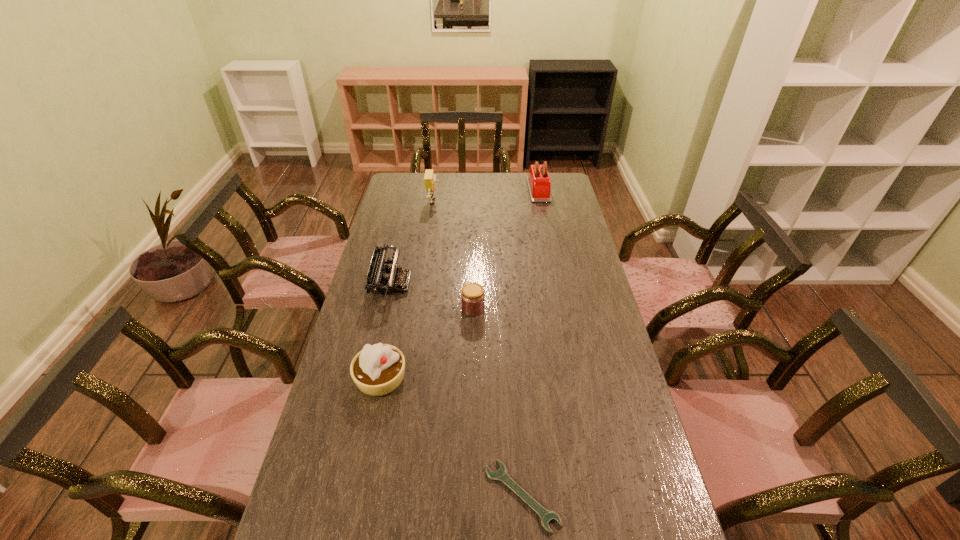
Where is `vacant area at the right edge of the desktop`? vacant area at the right edge of the desktop is located at coordinates (568, 228).

The height and width of the screenshot is (540, 960). I want to click on vacant area that lies between the second shortest object and the typewriter, so pos(432,296).

Identify the location of free space between the typewriter and the sponge. Image resolution: width=960 pixels, height=540 pixels. (413, 242).

Locate an element on the screen. The height and width of the screenshot is (540, 960). free point between the jam and the toaster is located at coordinates (506, 249).

Identify the location of empty location between the typewriter and the rightmost object. This screenshot has width=960, height=540. (465, 237).

Find the location of a particular element. Image resolution: width=960 pixels, height=540 pixels. free spot between the rightmost object and the typewriter is located at coordinates (465, 237).

You are a GUI agent. You are given a task and a screenshot of the screen. Output one action in this format:
    pyautogui.click(x=<x>, y=<y>)
    Task: Click on the vacant space in between the jam and the toaster
    This screenshot has width=960, height=540.
    Given the screenshot: What is the action you would take?
    pyautogui.click(x=506, y=249)

What are the coordinates of `vacant point located between the rightmost object and the nearest object` in the screenshot? It's located at (530, 342).

I want to click on empty space between the toaster and the nearest object, so click(530, 342).

Find the location of `unoccupied area between the wrench and the sponge`. unoccupied area between the wrench and the sponge is located at coordinates (478, 348).